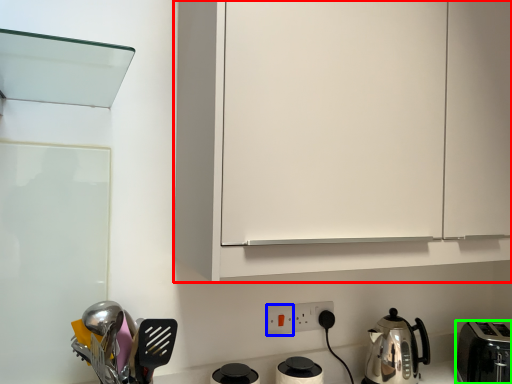
Question: Estimate the real-world distances between objects in this image. Which object is closer to cabinetry (highlighted by a red box), electric outlet (highlighted by a blue box) or toaster (highlighted by a green box)?

Choices:
 (A) electric outlet
 (B) toaster

Answer: (A)